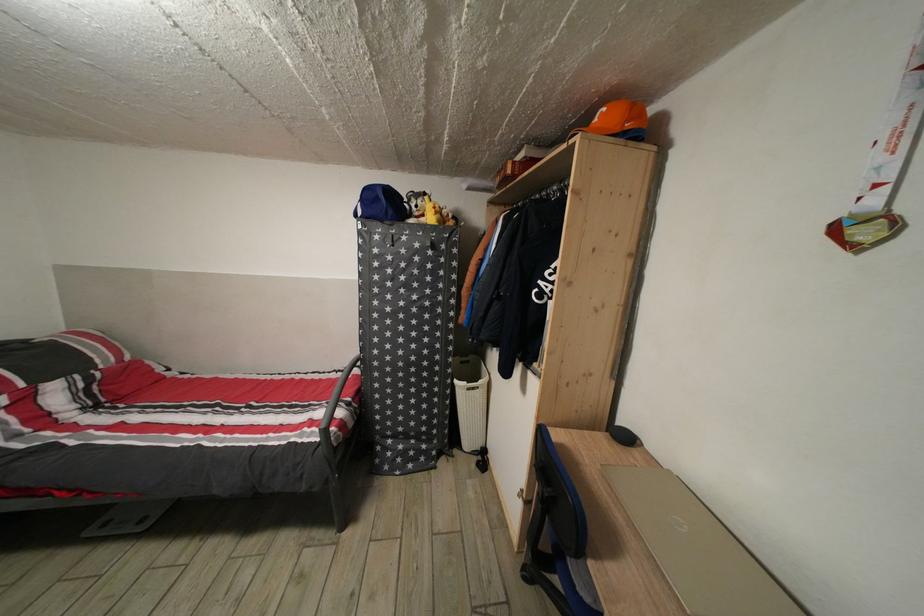
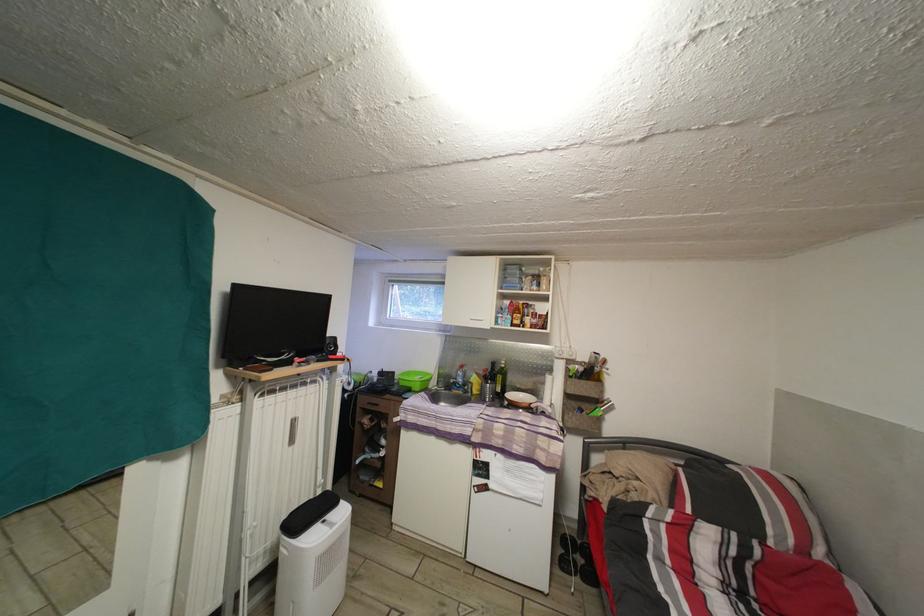
Question: The camera is either moving clockwise (left) or counter-clockwise (right) around the object. The first image is from the beginning of the video and the second image is from the end. Is the camera moving left or right when shooting the video?

Choices:
 (A) Left
 (B) Right

Answer: (B)